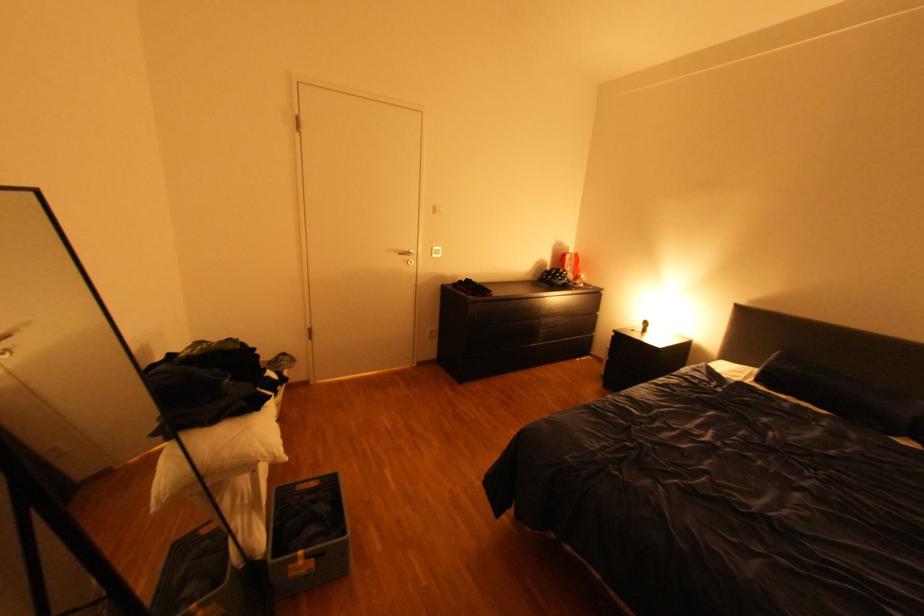
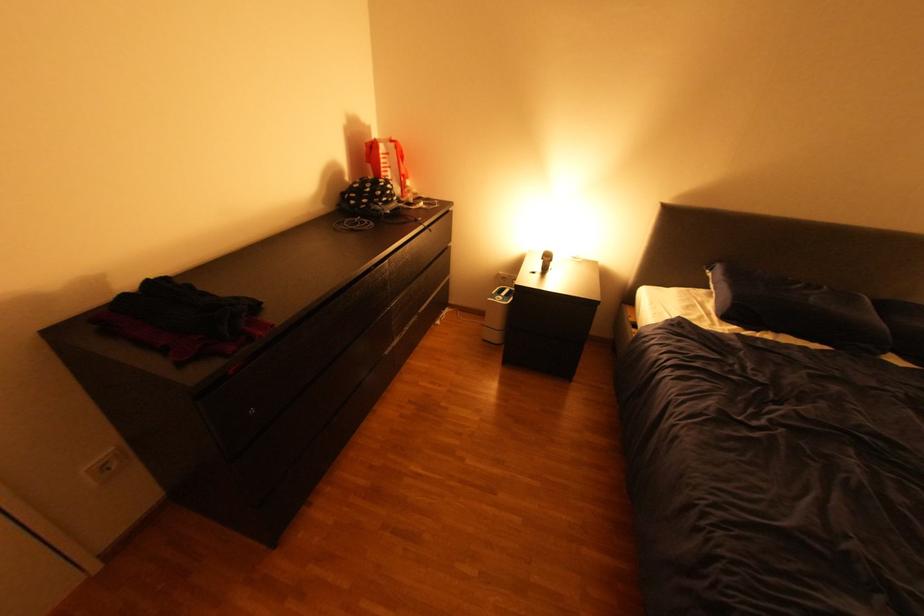
Locate, in the second image, the point that corresponds to point 578,246 in the first image.

(379, 129)